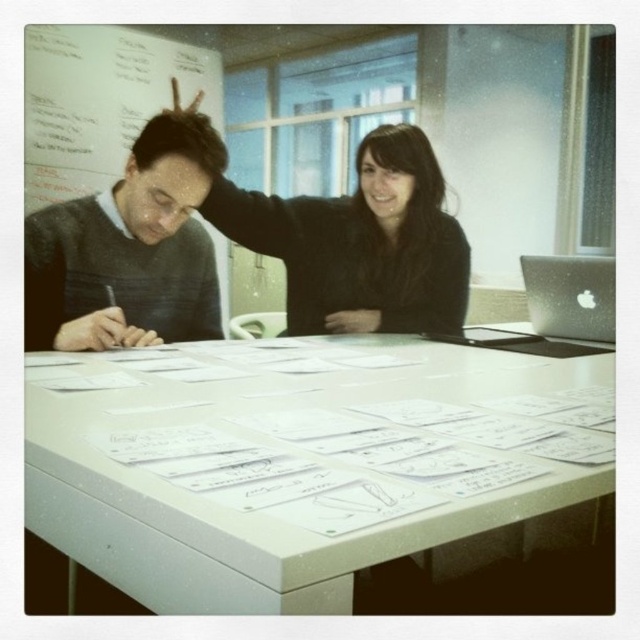
Question: Is white plastic table at center to the right of gray sweater at left from the viewer's perspective?

Choices:
 (A) yes
 (B) no

Answer: (A)

Question: Which point is closer to the camera taking this photo?

Choices:
 (A) (372, 198)
 (B) (596, 298)

Answer: (A)

Question: Is gray sweater at left thinner than silver metallic laptop at upper right?

Choices:
 (A) no
 (B) yes

Answer: (A)

Question: Which point is closer to the camera?

Choices:
 (A) white matte paperboard at upper left
 (B) silver metallic laptop at upper right

Answer: (B)

Question: Which point is closer to the camera?

Choices:
 (A) silver metallic laptop at upper right
 (B) black matte sweater at upper center
 (C) white plastic table at center
 (D) gray sweater at left

Answer: (C)

Question: Can you confirm if white plastic table at center is positioned to the right of silver metallic laptop at upper right?

Choices:
 (A) no
 (B) yes

Answer: (A)